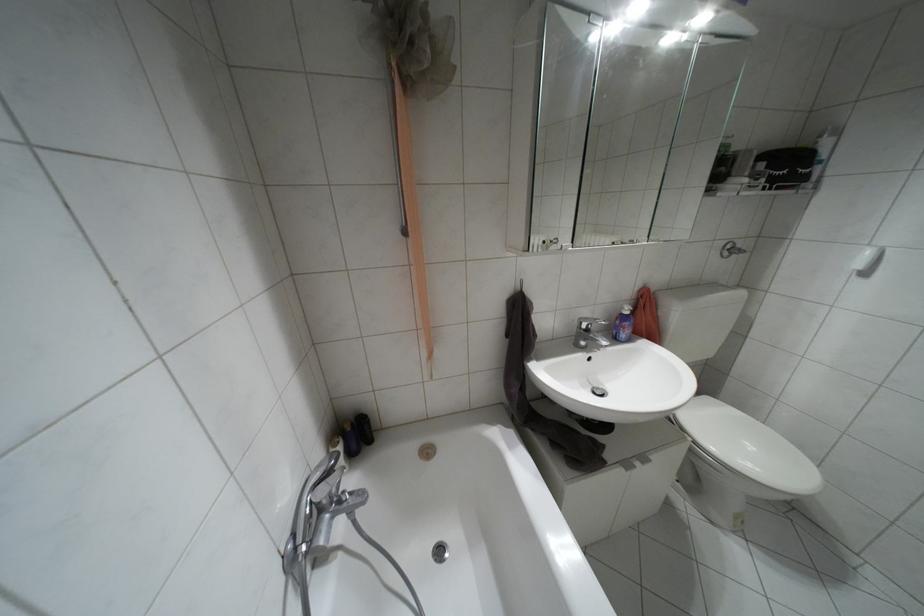
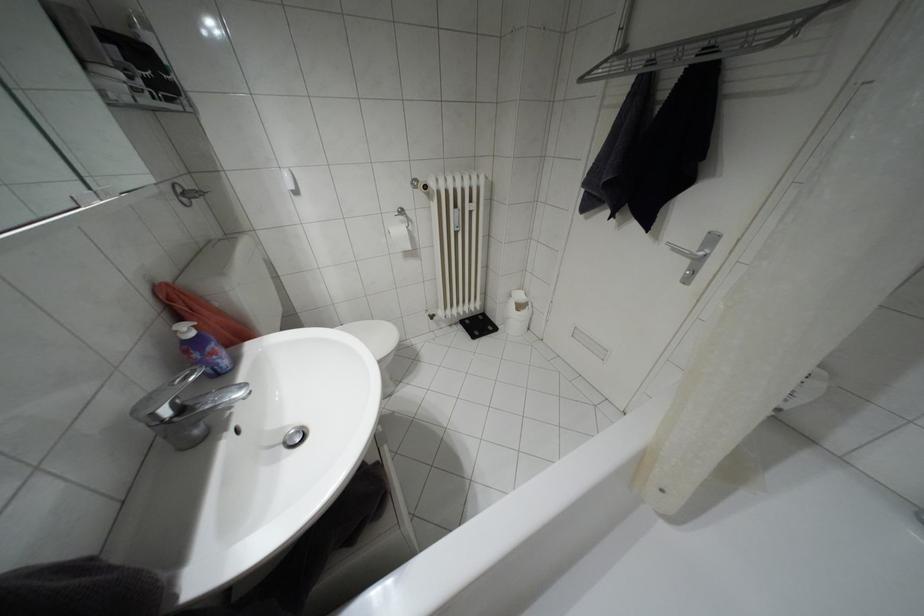
Find the pixel in the second image that matches pixel 587 330 in the first image.

(180, 408)